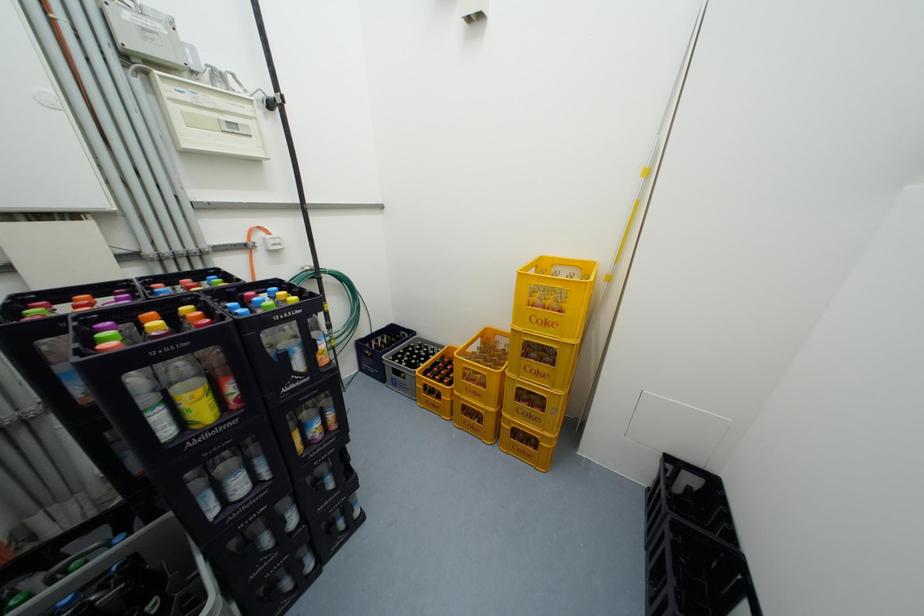
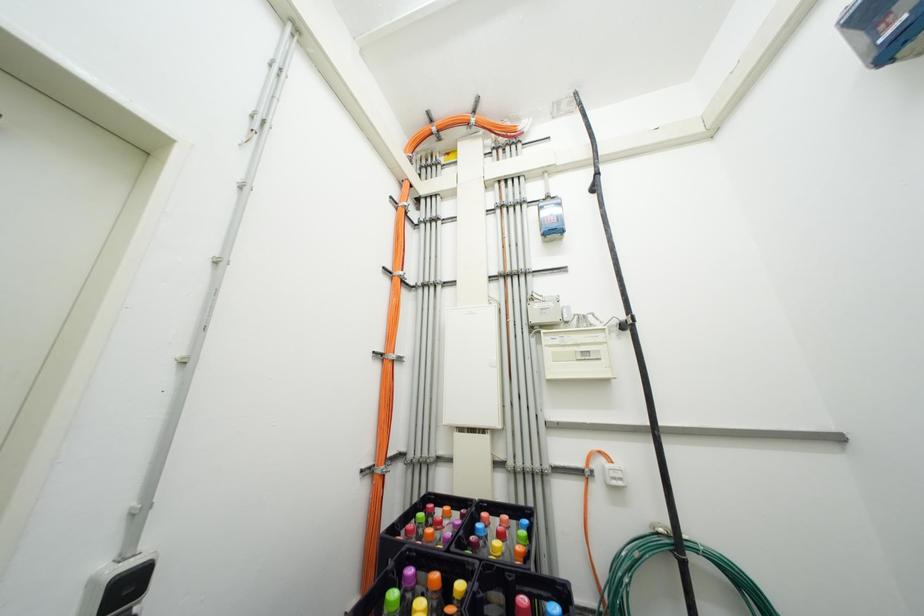
The first image is from the beginning of the video and the second image is from the end. How did the camera likely rotate when shooting the video?

The camera rotated toward left-up.